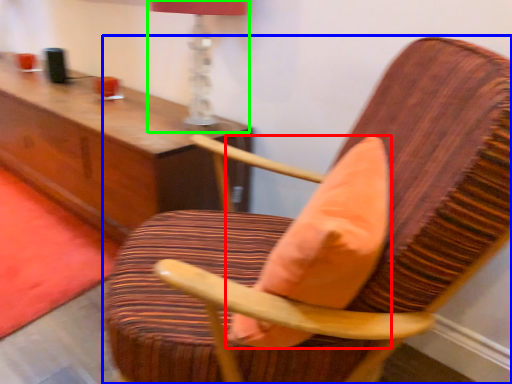
Question: Considering the real-world distances, which object is farthest from throw pillow (highlighted by a red box)? chair (highlighted by a blue box) or table lamp (highlighted by a green box)?

Choices:
 (A) chair
 (B) table lamp

Answer: (B)